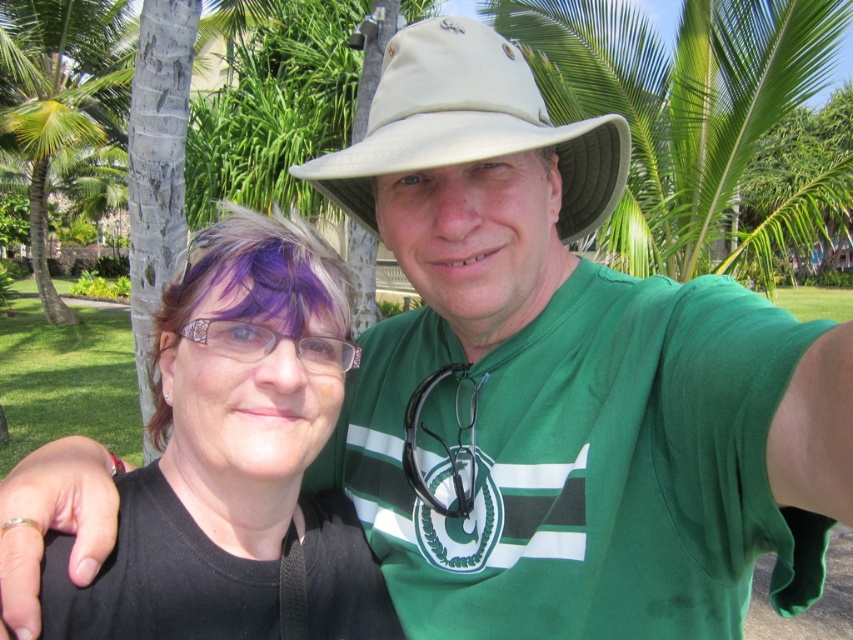
Between purple dyed hair at left and green leafy palm tree at upper left, which one is positioned higher?

green leafy palm tree at upper left

Can you confirm if purple dyed hair at left is positioned below green leafy palm tree at upper left?

Correct, purple dyed hair at left is located below green leafy palm tree at upper left.

The image size is (853, 640). Identify the location of purple dyed hair at left. (254, 296).

Which is behind, point (244, 369) or point (39, 262)?

The point (39, 262) is behind.

Is black matte hair at center to the left of green leafy palm tree at upper left from the viewer's perspective?

Incorrect, black matte hair at center is not on the left side of green leafy palm tree at upper left.

Who is more forward, (251, 332) or (111, 29)?

Point (251, 332) is in front.

At what (x,y) coordinates should I click in order to perform the action: click on black matte hair at center. Please return your answer as a coordinate pair (x, y). The height and width of the screenshot is (640, 853). Looking at the image, I should click on (235, 460).

Is point (479, 42) closer to viewer compared to point (117, 33)?

Yes.

Measure the distance between point (618, 192) and camera.

Point (618, 192) and camera are 1.22 meters apart from each other.

The image size is (853, 640). I want to click on beige fabric hat at center, so click(x=469, y=124).